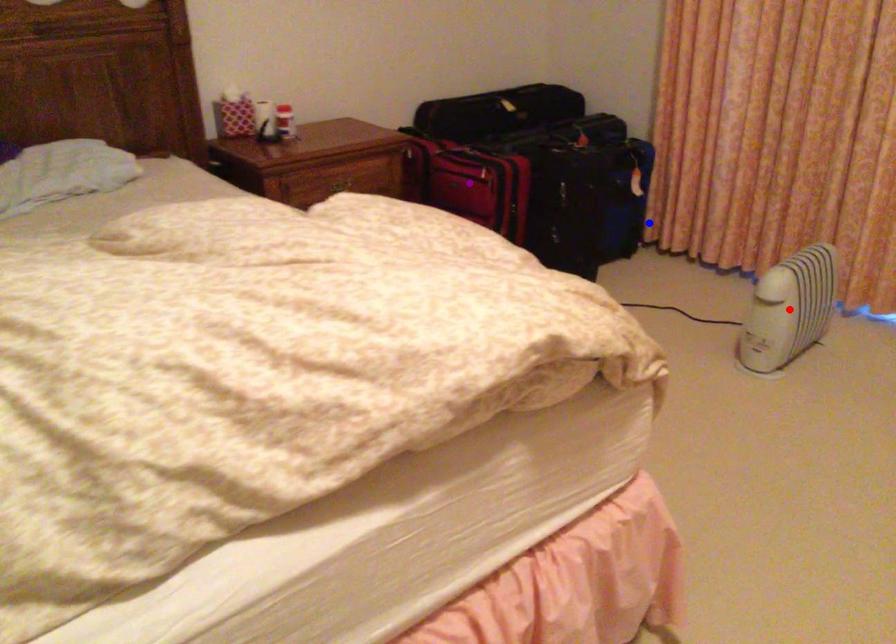
Order these from farthest to nearest:
A) purple point
B) blue point
C) red point

blue point → purple point → red point